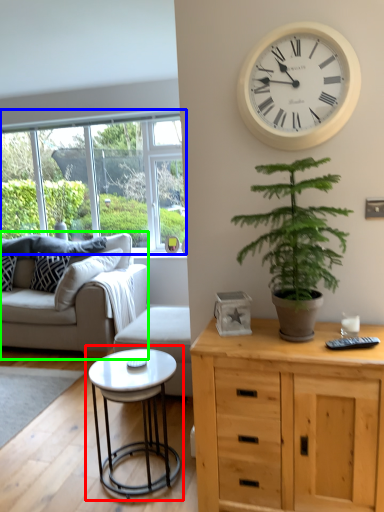
Question: Which is nearer to the coffee table (highlighted by a red box)? window (highlighted by a blue box) or studio couch (highlighted by a green box).

Choices:
 (A) window
 (B) studio couch

Answer: (B)